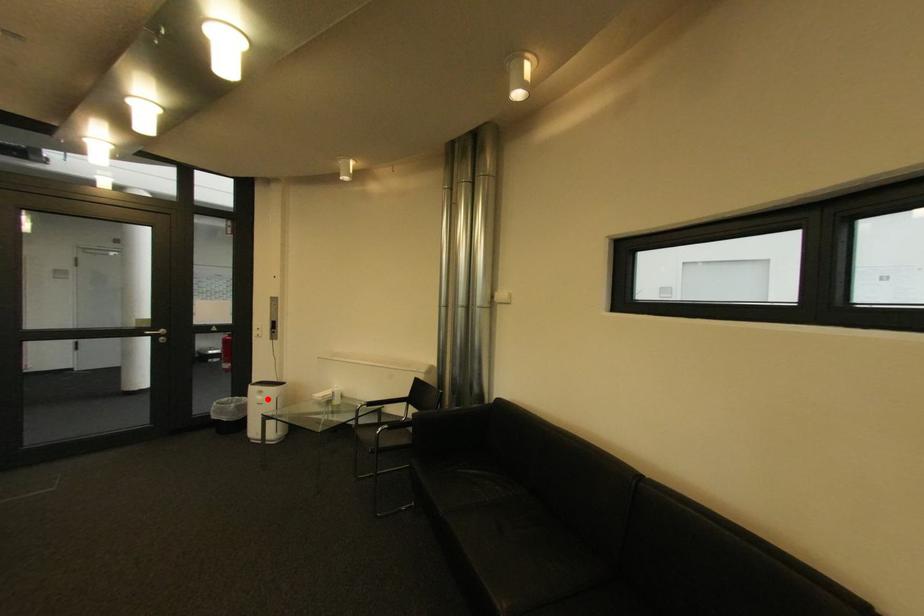
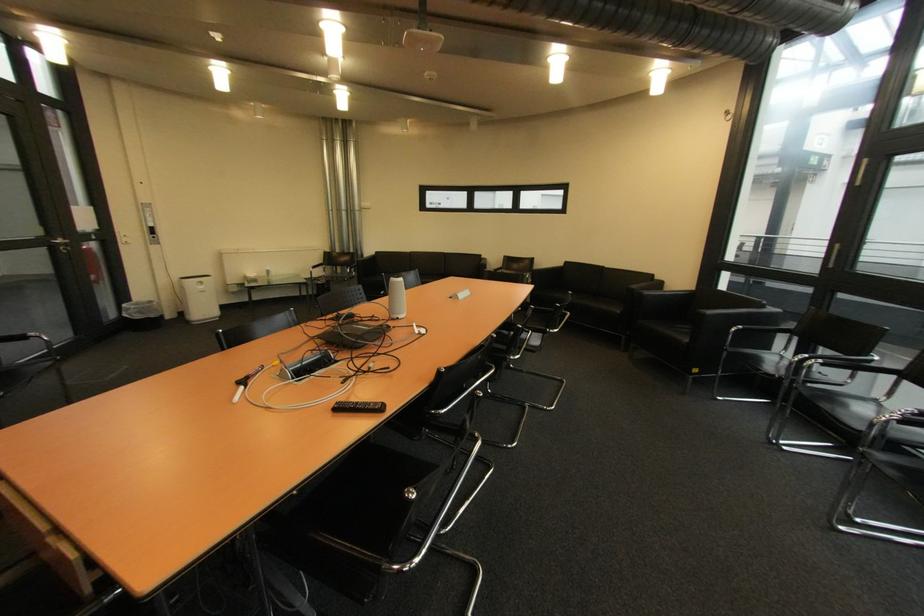
In the second image, find the point that corresponds to the highlighted location in the first image.

(209, 288)